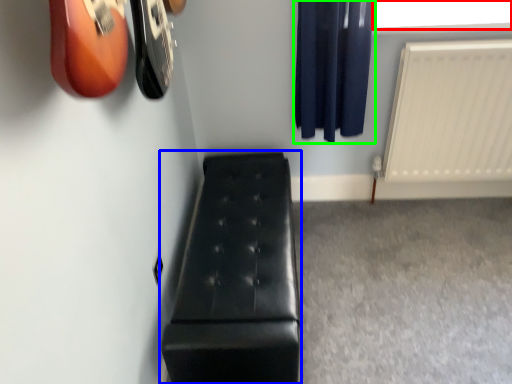
Question: Considering the real-world distances, which object is farthest from window screen (highlighted by a red box)? furniture (highlighted by a blue box) or curtain (highlighted by a green box)?

Choices:
 (A) furniture
 (B) curtain

Answer: (A)